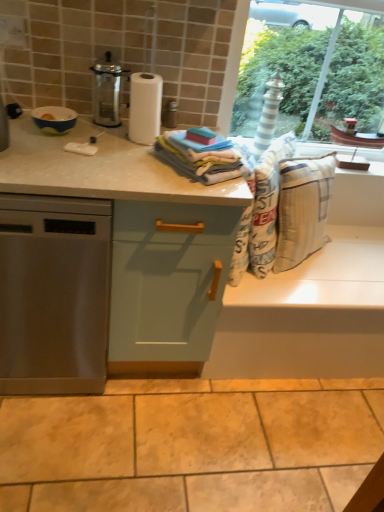
Question: Is metallic glass carafe at upper left positioned beyond the bounds of stainless steel dishwasher at left?

Choices:
 (A) no
 (B) yes

Answer: (B)

Question: Is metallic glass carafe at upper left facing away from stainless steel dishwasher at left?

Choices:
 (A) no
 (B) yes

Answer: (A)

Question: Does metallic glass carafe at upper left have a greater width compared to stainless steel dishwasher at left?

Choices:
 (A) yes
 (B) no

Answer: (B)

Question: Is metallic glass carafe at upper left further to the viewer compared to stainless steel dishwasher at left?

Choices:
 (A) yes
 (B) no

Answer: (A)

Question: Does metallic glass carafe at upper left have a lesser height compared to stainless steel dishwasher at left?

Choices:
 (A) no
 (B) yes

Answer: (B)

Question: Is stainless steel dishwasher at left bigger or smaller than beige cotton laundry at center?

Choices:
 (A) big
 (B) small

Answer: (A)

Question: Considering the positions of point (8, 231) and point (264, 188), is point (8, 231) closer or farther from the camera than point (264, 188)?

Choices:
 (A) closer
 (B) farther

Answer: (A)

Question: From the image's perspective, relative to beige cotton laundry at center, is stainless steel dishwasher at left above or below?

Choices:
 (A) below
 (B) above

Answer: (A)

Question: From a real-world perspective, relative to beige cotton laundry at center, is stainless steel dishwasher at left vertically above or below?

Choices:
 (A) above
 (B) below

Answer: (B)

Question: Is light green wood cabinet at center wider or thinner than beige cotton laundry at center?

Choices:
 (A) wide
 (B) thin

Answer: (A)

Question: Is light green wood cabinet at center spatially inside beige cotton laundry at center, or outside of it?

Choices:
 (A) inside
 (B) outside

Answer: (B)

Question: From a real-world perspective, is light green wood cabinet at center above or below beige cotton laundry at center?

Choices:
 (A) above
 (B) below

Answer: (B)

Question: From their relative heights in the image, would you say light green wood cabinet at center is taller or shorter than beige cotton laundry at center?

Choices:
 (A) tall
 (B) short

Answer: (A)

Question: In terms of width, does metallic glass carafe at upper left look wider or thinner when compared to soft cotton towels at center?

Choices:
 (A) thin
 (B) wide

Answer: (A)

Question: From the image's perspective, is metallic glass carafe at upper left located above or below soft cotton towels at center?

Choices:
 (A) below
 (B) above

Answer: (B)